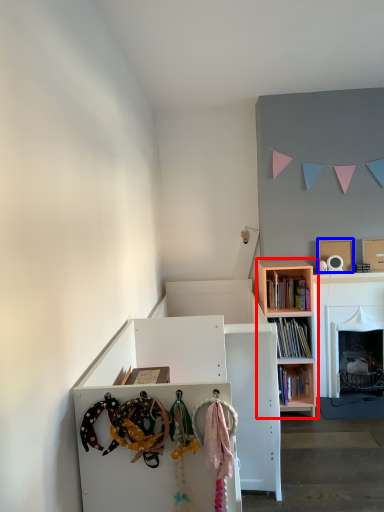
Question: Which object is further to the camera taking this photo, bookcase (highlighted by a red box) or cardboard box (highlighted by a blue box)?

Choices:
 (A) bookcase
 (B) cardboard box

Answer: (B)